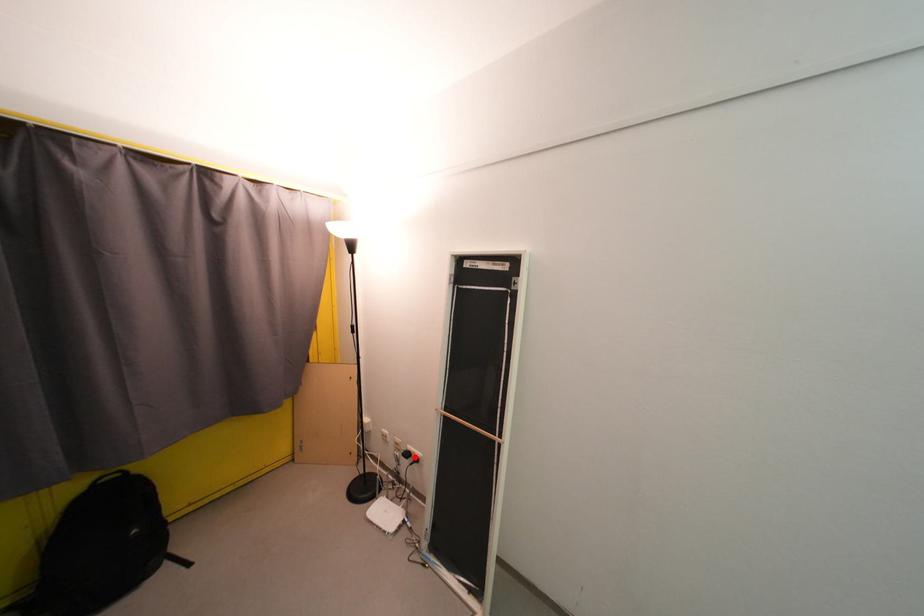
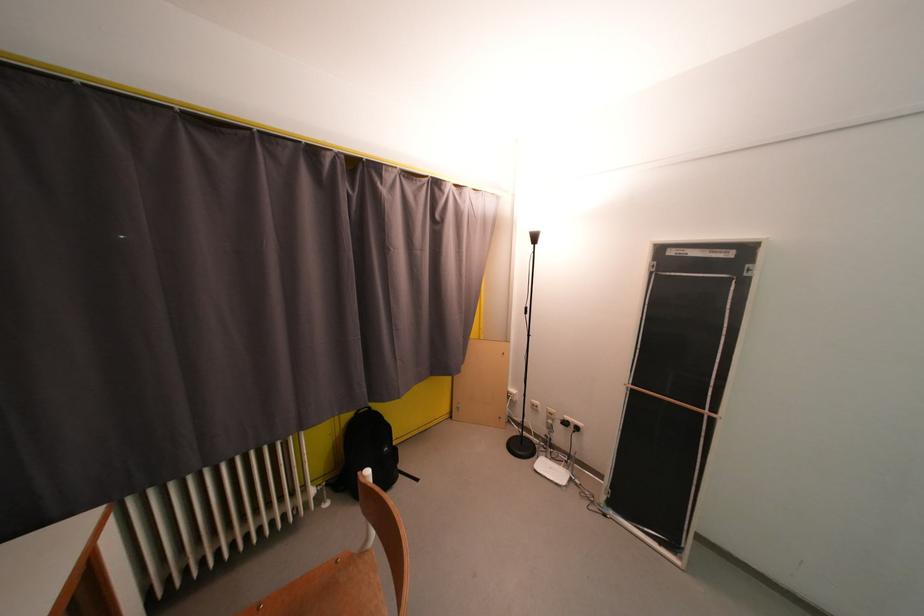
Find the pixel in the second image that matches the highlighted location in the first image.

(573, 427)